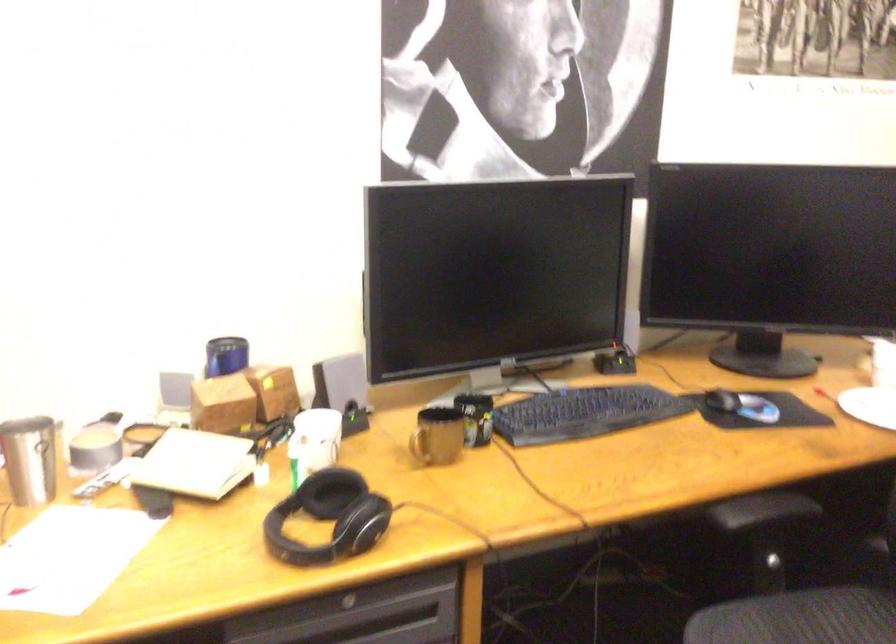
Where is `chair sitting surface`? This screenshot has height=644, width=896. chair sitting surface is located at coordinates (805, 612).